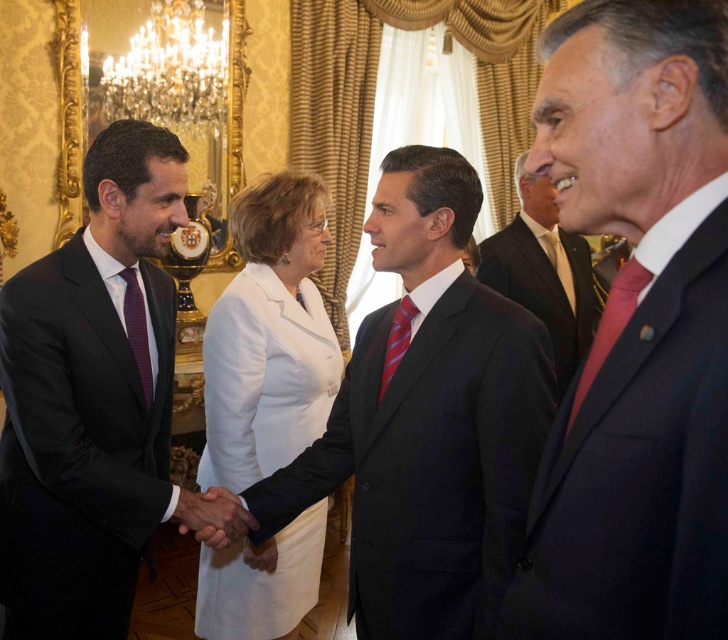
In order to click on dark suit at left in this screenshot , I will do click(x=90, y=400).

Is point (7, 525) positioned behind point (407, 314)?

That is False.

Is point (66, 564) in front of point (395, 310)?

Yes, it is.

The height and width of the screenshot is (640, 728). In order to click on dark suit at left in this screenshot , I will do `click(90, 400)`.

Between point (587, 545) and point (242, 445), which one is positioned behind?

The point (242, 445) is more distant.

Does point (692, 461) come closer to viewer compared to point (229, 337)?

Yes.

Identify the location of dark blue suit at center. (637, 330).

Locate an element on the screen. The width and height of the screenshot is (728, 640). dark blue suit at center is located at coordinates (637, 330).

Is smooth skin handshake at center further to camera compared to plaid fabric tie at left?

No, smooth skin handshake at center is closer to the viewer.

Is smooth skin handshake at center to the left of plaid fabric tie at left from the viewer's perspective?

In fact, smooth skin handshake at center is to the right of plaid fabric tie at left.

Does point (234, 529) lie in front of point (146, 339)?

That is True.

Locate an element on the screen. smooth skin handshake at center is located at coordinates (213, 516).